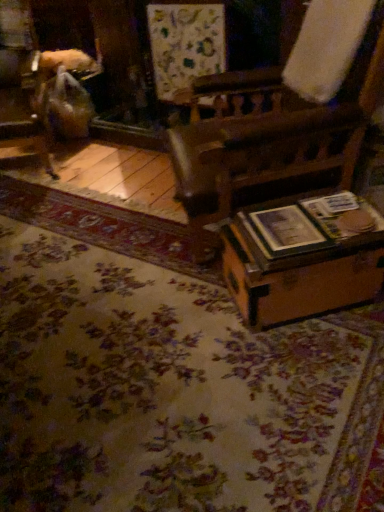
Question: Is floral carpet at center in front of or behind wooden chair at left in the image?

Choices:
 (A) behind
 (B) front

Answer: (B)

Question: From the image's perspective, is floral carpet at center located above or below wooden chair at left?

Choices:
 (A) below
 (B) above

Answer: (A)

Question: Estimate the real-world distances between objects in this image. Which object is closer to the wooden trunk at lower right?

Choices:
 (A) floral carpet at center
 (B) wooden chair at left

Answer: (A)

Question: Considering the real-world distances, which object is closest to the floral carpet at center?

Choices:
 (A) wooden trunk at lower right
 (B) wooden chair at left

Answer: (A)